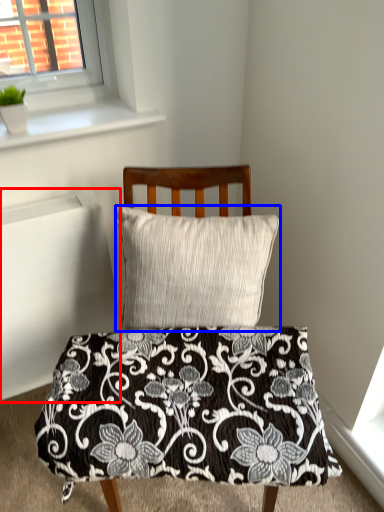
Question: Among these objects, which one is nearest to the camera, radiator (highlighted by a red box) or pillow (highlighted by a blue box)?

Choices:
 (A) radiator
 (B) pillow

Answer: (B)